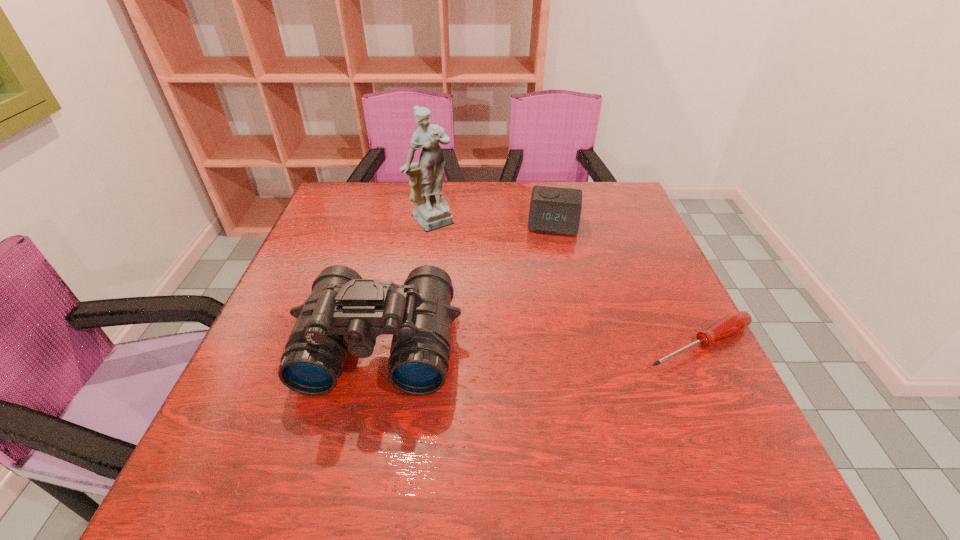
This screenshot has width=960, height=540. Identify the location of vacant spot on the desktop that is between the second tallest object and the screwdriver and is positioned on the front-facing side of the third tallest object. (539, 344).

Where is `free space on the desktop that is between the second tallest object and the shortest object and is positioned on the front-facing side of the figurine`? The width and height of the screenshot is (960, 540). free space on the desktop that is between the second tallest object and the shortest object and is positioned on the front-facing side of the figurine is located at coordinates (573, 344).